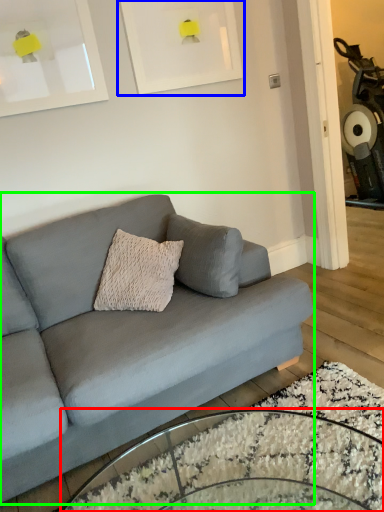
Question: Which is nearer to the coffee table (highlighted by a red box)? picture frame (highlighted by a blue box) or studio couch (highlighted by a green box).

Choices:
 (A) picture frame
 (B) studio couch

Answer: (B)